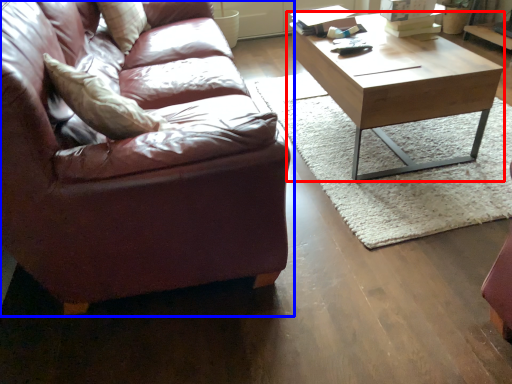
Question: Which point is closer to the camera, coffee table (highlighted by a red box) or studio couch (highlighted by a blue box)?

Choices:
 (A) coffee table
 (B) studio couch

Answer: (B)